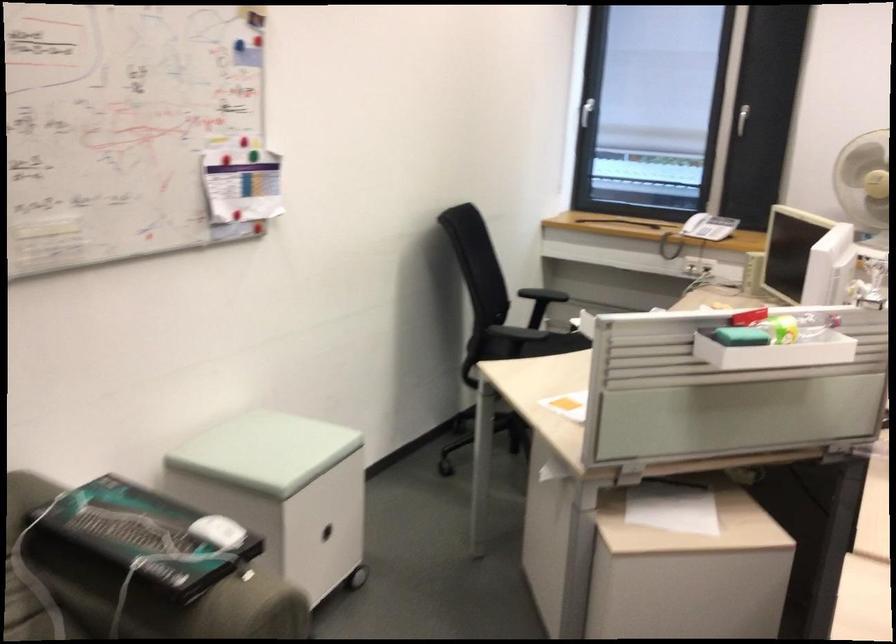
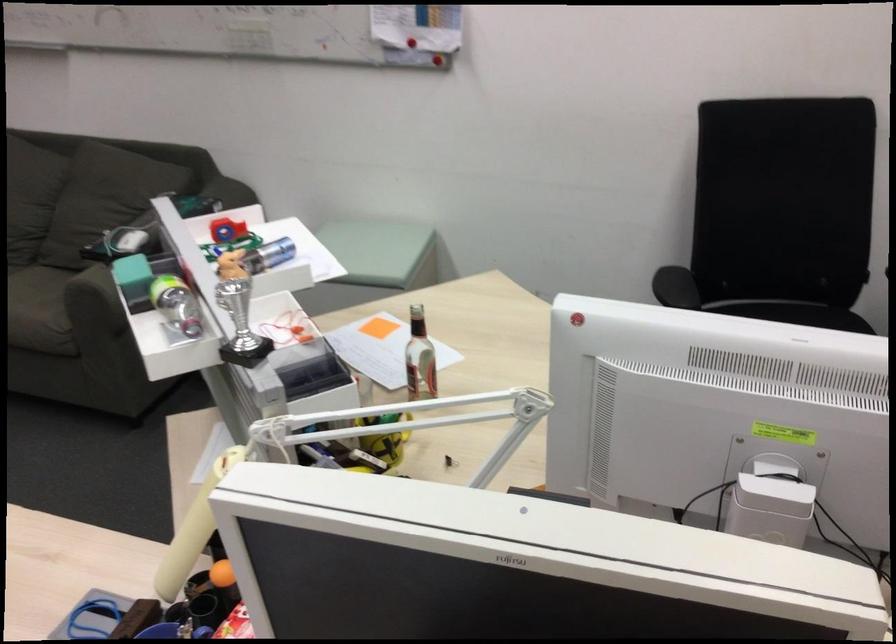
In the second image, find the point that corresponds to the point at 776,390 in the first image.

(367, 460)